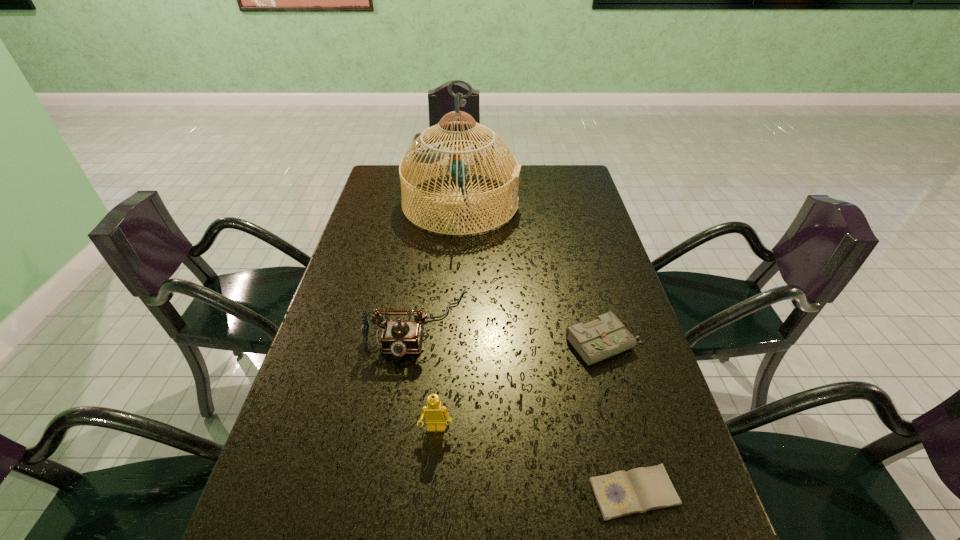
What are the coordinates of `vacant space that's between the farthest object and the second shortest object` in the screenshot? It's located at (533, 273).

At what (x,y) coordinates should I click in order to perform the action: click on the third closest object to the taller diary. Please return your answer as a coordinate pair (x, y). Image resolution: width=960 pixels, height=540 pixels. Looking at the image, I should click on (434, 413).

Identify which object is located as the nearest to the second nearest object. Please provide its 2D coordinates. Your answer should be formatted as a tuple, i.e. [(x, y)], where the tuple contains the x and y coordinates of a point satisfying the conditions above.

[(399, 337)]

Identify which diary is located as the second nearest to the tallest object. Please provide its 2D coordinates. Your answer should be formatted as a tuple, i.e. [(x, y)], where the tuple contains the x and y coordinates of a point satisfying the conditions above.

[(621, 493)]

Identify which diary is the closest to the Lego. Please provide its 2D coordinates. Your answer should be formatted as a tuple, i.e. [(x, y)], where the tuple contains the x and y coordinates of a point satisfying the conditions above.

[(621, 493)]

You are a GUI agent. You are given a task and a screenshot of the screen. Output one action in this format:
    pyautogui.click(x=<x>, y=<y>)
    Task: Click on the free space that satisfies the following two spatial constraints: 1. on the face of the nearer diary; 2. on the right side of the Lego
    
    Given the screenshot: What is the action you would take?
    pyautogui.click(x=431, y=492)

This screenshot has height=540, width=960. In order to click on free location that satisfies the following two spatial constraints: 1. on the face of the Lego; 2. on the right side of the nearest object in this screenshot , I will do `click(431, 492)`.